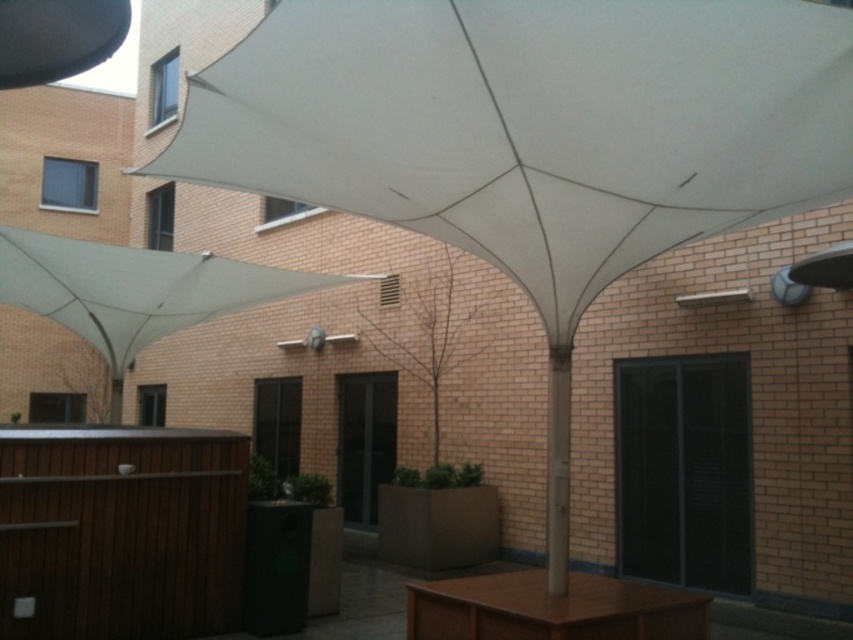
Does point (612, 224) lie behind point (469, 637)?

No, it is not.

Consider the image. Does white fabric canopy at center have a lesser height compared to brown wooden table at center?

No.

Is point (524, 81) positioned in front of point (708, 596)?

Yes, it is in front of point (708, 596).

What are the coordinates of `white fabric canopy at center` in the screenshot? It's located at (532, 124).